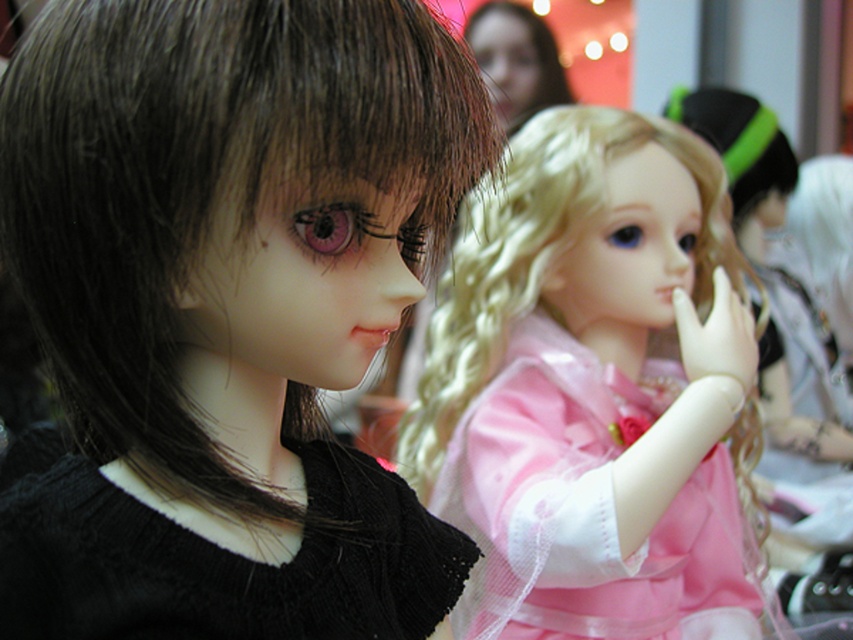
Question: Which point is farther to the camera?

Choices:
 (A) black knitted dress at left
 (B) shiny blonde wig at center

Answer: (B)

Question: Does shiny blonde wig at center appear over black knitted dress at left?

Choices:
 (A) no
 (B) yes

Answer: (B)

Question: Does shiny blonde wig at center appear under black knitted dress at left?

Choices:
 (A) no
 (B) yes

Answer: (A)

Question: Considering the real-world distances, which object is closest to the black knitted dress at left?

Choices:
 (A) shiny blonde wig at center
 (B) dark brown silky hair at left

Answer: (B)

Question: Among these points, which one is farthest from the camera?

Choices:
 (A) (299, 557)
 (B) (314, 35)

Answer: (A)

Question: Is shiny blonde wig at center to the left of black knitted dress at left from the viewer's perspective?

Choices:
 (A) yes
 (B) no

Answer: (B)